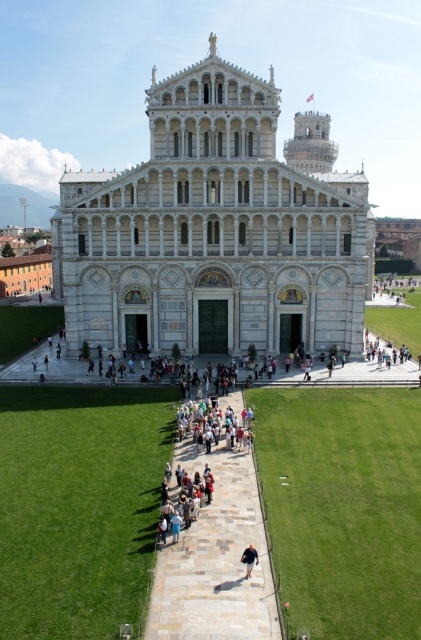
Question: Does white marble palace at center have a smaller size compared to light blue denim jeans at lower center?

Choices:
 (A) yes
 (B) no

Answer: (B)

Question: Which of the following is the closest to the observer?

Choices:
 (A) (245, 564)
 (B) (199, 504)
 (C) (207, 161)
 (D) (197, 428)

Answer: (A)

Question: Can you confirm if multicolored fabric crowd at center is positioned above light blue denim jeans at lower center?

Choices:
 (A) no
 (B) yes

Answer: (B)

Question: Is multicolored fabric crowd at center closer to the viewer compared to light brown leather shoes at center?

Choices:
 (A) no
 (B) yes

Answer: (A)

Question: Which is farther from the light brown leather shoes at center?

Choices:
 (A) white marble palace at center
 (B) light blue denim jeans at lower center
 (C) multicolored fabric crowd at center

Answer: (A)

Question: Which object appears closest to the camera in this image?

Choices:
 (A) white marble palace at center
 (B) light brown leather shoes at center
 (C) multicolored fabric crowd at center

Answer: (B)